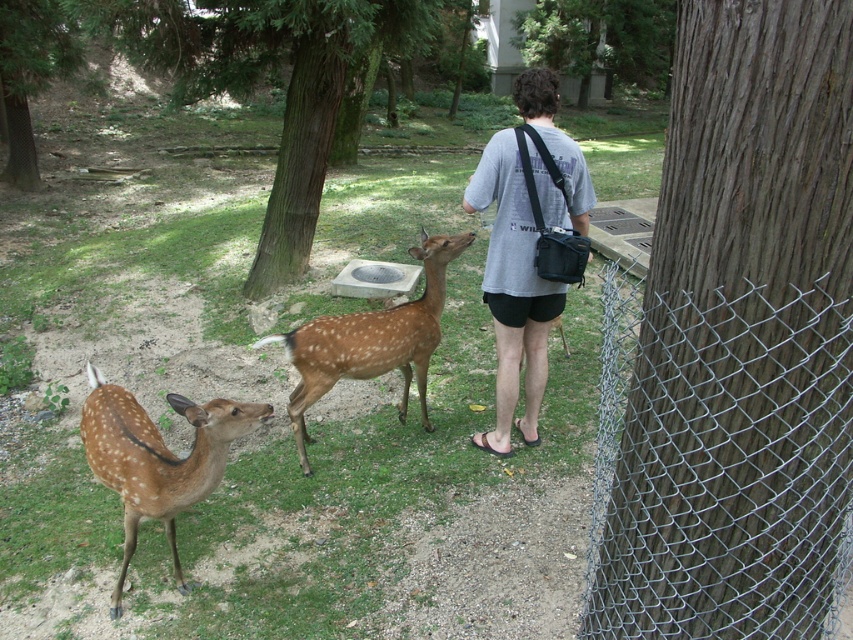
Between brown rough bark tree at center right and green textured tree at upper left, which one appears on the right side from the viewer's perspective?

brown rough bark tree at center right is more to the right.

Locate an element on the screen. Image resolution: width=853 pixels, height=640 pixels. brown rough bark tree at center right is located at coordinates (740, 339).

What do you see at coordinates (740, 339) in the screenshot?
I see `brown rough bark tree at center right` at bounding box center [740, 339].

Which is above, brown rough bark tree at center right or brown rough tree at center?

Positioned higher is brown rough tree at center.

Which is behind, point (659, 547) or point (292, 147)?

Positioned behind is point (292, 147).

Identify the location of brown rough bark tree at center right. (740, 339).

Can you confirm if spotted fur deer at lower left is positioned to the left of green textured tree at upper left?

Incorrect, spotted fur deer at lower left is not on the left side of green textured tree at upper left.

Who is positioned more to the right, spotted fur deer at lower left or green textured tree at upper left?

Positioned to the right is spotted fur deer at lower left.

Who is more forward, (129, 444) or (20, 104)?

Positioned in front is point (129, 444).

The height and width of the screenshot is (640, 853). I want to click on spotted fur deer at lower left, so click(x=157, y=458).